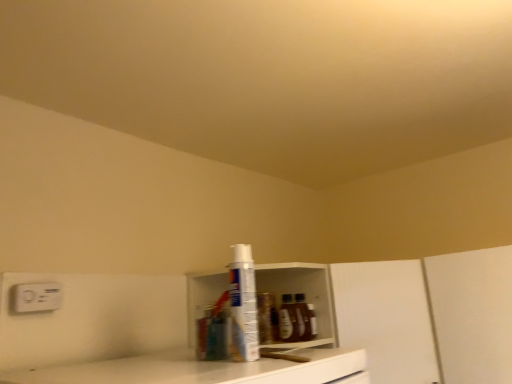
The width and height of the screenshot is (512, 384). Identify the location of white plastic electric outlet at upper left. (37, 297).

Measure the distance between white plastic shelf at center and camera.

white plastic shelf at center and camera are 3.30 feet apart.

The width and height of the screenshot is (512, 384). What are the coordinates of `white plastic spray can at center` in the screenshot? It's located at (243, 305).

At what (x,y) coordinates should I click in order to perform the action: click on white matte cabinet at center. Please return your answer as a coordinate pair (x, y). Image resolution: width=512 pixels, height=384 pixels. Looking at the image, I should click on (364, 313).

Can you confirm if white plastic spray can at center is shorter than white plastic electric outlet at upper left?

No.

Is white plastic spray can at center aimed at white plastic electric outlet at upper left?

No, white plastic spray can at center does not turn towards white plastic electric outlet at upper left.

Between white plastic spray can at center and white plastic electric outlet at upper left, which one has larger width?

white plastic spray can at center.

From the image's perspective, is white plastic spray can at center positioned above or below white plastic electric outlet at upper left?

Based on their image positions, white plastic spray can at center is located above white plastic electric outlet at upper left.

From the image's perspective, would you say white plastic electric outlet at upper left is shown under white plastic shelf at center?

No, from the image's perspective, white plastic electric outlet at upper left is not below white plastic shelf at center.

Considering the positions of objects white plastic electric outlet at upper left and white plastic shelf at center in the image provided, who is in front, white plastic electric outlet at upper left or white plastic shelf at center?

white plastic electric outlet at upper left is more forward.

How different are the orientations of white plastic electric outlet at upper left and white plastic shelf at center in degrees?

There is a 1.75-degree angle between the facing directions of white plastic electric outlet at upper left and white plastic shelf at center.

Based on their sizes in the image, would you say white plastic electric outlet at upper left is bigger or smaller than white plastic shelf at center?

white plastic electric outlet at upper left is smaller than white plastic shelf at center.

Does white matte cabinet at center have a greater width compared to white plastic electric outlet at upper left?

Correct, the width of white matte cabinet at center exceeds that of white plastic electric outlet at upper left.

From their relative heights in the image, would you say white matte cabinet at center is taller or shorter than white plastic electric outlet at upper left?

Considering their sizes, white matte cabinet at center has more height than white plastic electric outlet at upper left.

Could you tell me if white plastic electric outlet at upper left is turned towards white matte cabinet at center?

No, white plastic electric outlet at upper left is not aimed at white matte cabinet at center.

Does point (29, 285) come in front of point (353, 298)?

Yes, point (29, 285) is in front of point (353, 298).

Considering the sizes of objects white plastic electric outlet at upper left and white matte cabinet at center in the image provided, who is wider, white plastic electric outlet at upper left or white matte cabinet at center?

With larger width is white matte cabinet at center.

Can you confirm if white plastic electric outlet at upper left is positioned to the left of white matte cabinet at center?

Indeed, white plastic electric outlet at upper left is positioned on the left side of white matte cabinet at center.

Is point (291, 345) closer to camera compared to point (41, 292)?

No.

Which is in front, white plastic shelf at center or white plastic electric outlet at upper left?

Positioned in front is white plastic electric outlet at upper left.

The image size is (512, 384). Find the location of `electric outlet lying in front of the white plastic shelf at center`. electric outlet lying in front of the white plastic shelf at center is located at coordinates (37, 297).

Considering the relative positions of white plastic shelf at center and white plastic electric outlet at upper left in the image provided, is white plastic shelf at center to the left of white plastic electric outlet at upper left from the viewer's perspective?

In fact, white plastic shelf at center is to the right of white plastic electric outlet at upper left.

Considering the positions of objects white plastic shelf at center and white plastic spray can at center in the image provided, who is behind, white plastic shelf at center or white plastic spray can at center?

white plastic shelf at center.

At what (x,y) coordinates should I click in order to perform the action: click on shelf behind the white plastic spray can at center. Please return your answer as a coordinate pair (x, y). Looking at the image, I should click on (294, 294).

Can we say white plastic shelf at center lies outside white plastic spray can at center?

Yes.

Consider the image. Is white plastic shelf at center taller than white plastic spray can at center?

Yes.

Can you tell me how much white plastic electric outlet at upper left and white plastic spray can at center differ in facing direction?

4 degrees separate the facing orientations of white plastic electric outlet at upper left and white plastic spray can at center.

Is white plastic spray can at center inside white plastic electric outlet at upper left?

No, white plastic spray can at center is not surrounded by white plastic electric outlet at upper left.

Does white plastic electric outlet at upper left turn towards white plastic spray can at center?

Yes, white plastic electric outlet at upper left is oriented towards white plastic spray can at center.

Relative to white plastic spray can at center, is white plastic electric outlet at upper left in front or behind?

white plastic electric outlet at upper left is behind white plastic spray can at center.

I want to click on bottle lying in front of the white plastic electric outlet at upper left, so click(243, 305).

You are a GUI agent. You are given a task and a screenshot of the screen. Output one action in this format:
    pyautogui.click(x=<x>, y=<y>)
    Task: Click on the electric outlet above the white plastic shelf at center (from a real-world perspective)
    This screenshot has width=512, height=384.
    Given the screenshot: What is the action you would take?
    pyautogui.click(x=37, y=297)

Looking at the image, which one is located further to white plastic shelf at center, white plastic electric outlet at upper left or white matte cabinet at center?

white plastic electric outlet at upper left.

Based on their spatial positions, is white plastic spray can at center or white matte cabinet at center further from white plastic electric outlet at upper left?

white matte cabinet at center is further to white plastic electric outlet at upper left.

From the image, which object appears to be nearer to white plastic spray can at center, white plastic electric outlet at upper left or white plastic shelf at center?

white plastic shelf at center is positioned closer to the anchor white plastic spray can at center.

Based on their spatial positions, is white plastic shelf at center or white plastic electric outlet at upper left closer to white plastic spray can at center?

Based on the image, white plastic shelf at center appears to be nearer to white plastic spray can at center.

Looking at the image, which one is located closer to white plastic shelf at center, white plastic spray can at center or white matte cabinet at center?

The object closer to white plastic shelf at center is white matte cabinet at center.

From the image, which object appears to be nearer to white matte cabinet at center, white plastic shelf at center or white plastic electric outlet at upper left?

The object closer to white matte cabinet at center is white plastic shelf at center.

Looking at the image, which one is located closer to white plastic spray can at center, white matte cabinet at center or white plastic electric outlet at upper left?

The object closer to white plastic spray can at center is white plastic electric outlet at upper left.

When comparing their distances from white plastic spray can at center, does white plastic electric outlet at upper left or white matte cabinet at center seem closer?

white plastic electric outlet at upper left is closer to white plastic spray can at center.

The image size is (512, 384). Find the location of `shelf between white plastic spray can at center and white matte cabinet at center in the horizontal direction`. shelf between white plastic spray can at center and white matte cabinet at center in the horizontal direction is located at coordinates (294, 294).

This screenshot has width=512, height=384. What are the coordinates of `bottle located between white plastic electric outlet at upper left and white matte cabinet at center in the left-right direction` in the screenshot? It's located at (243, 305).

You are a GUI agent. You are given a task and a screenshot of the screen. Output one action in this format:
    pyautogui.click(x=<x>, y=<y>)
    Task: Click on the bottle located between white plastic electric outlet at upper left and white plastic shelf at center in the left-right direction
    
    Given the screenshot: What is the action you would take?
    click(x=243, y=305)

Where is `shelf between white plastic electric outlet at upper left and white matte cabinet at center from left to right`? This screenshot has width=512, height=384. shelf between white plastic electric outlet at upper left and white matte cabinet at center from left to right is located at coordinates (294, 294).